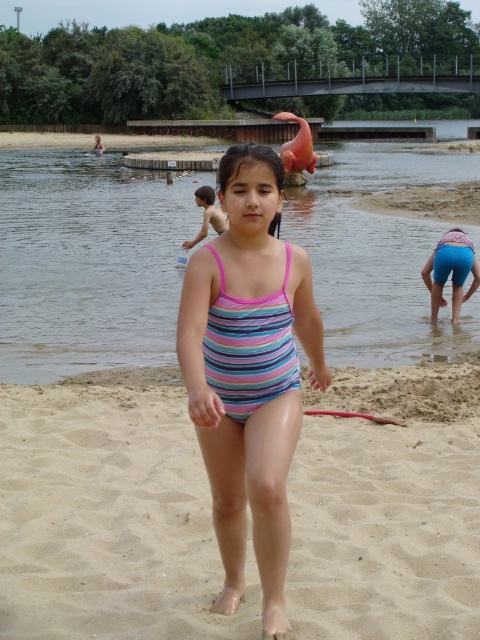
You are standing at the point with coordinates point (87, 262). What is the terrain like under your feet?

The point (87, 262) is on clear water at center, so the terrain under your feet would be water.